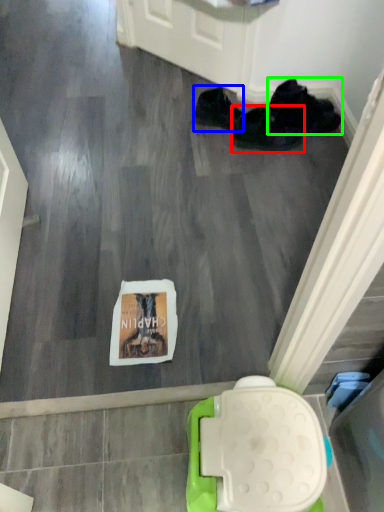
Question: Which is nearer to the footwear (highlighted by a red box)? footwear (highlighted by a blue box) or footwear (highlighted by a green box).

Choices:
 (A) footwear
 (B) footwear

Answer: (B)